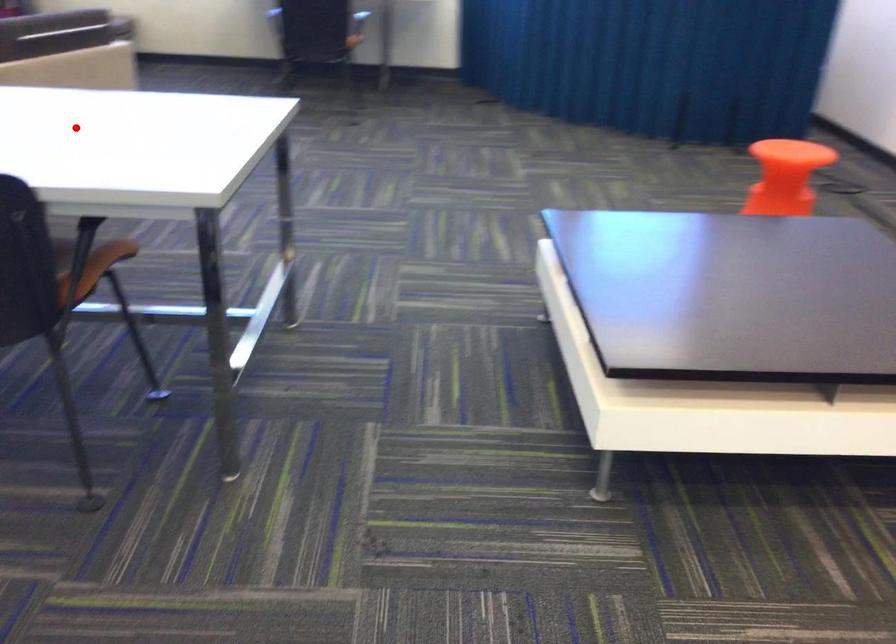
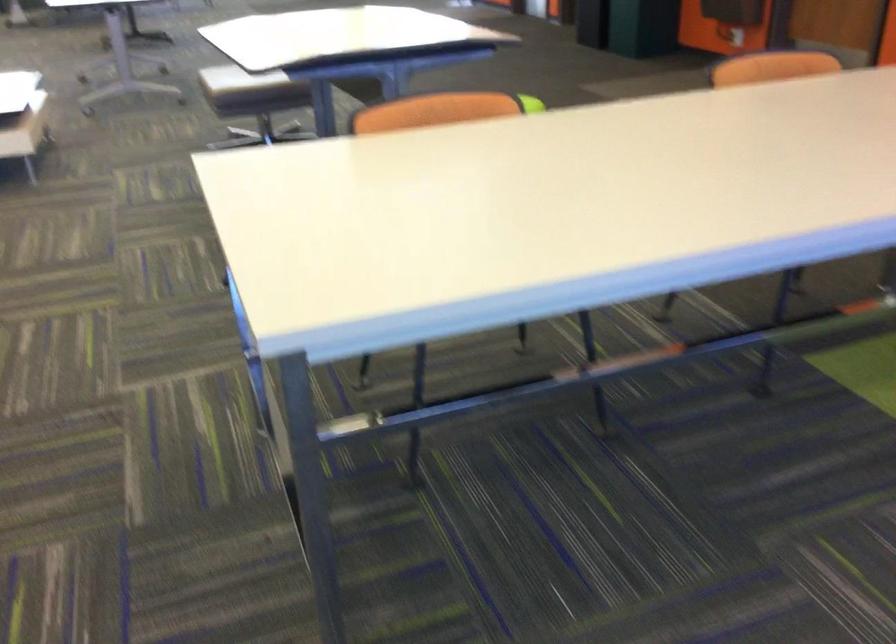
Question: I am providing you with two images of the same scene from different viewpoints. A red point is shown in image1. For the corresponding object point in image2, is it positioned nearer or farther from the camera?

Choices:
 (A) Nearer
 (B) Farther

Answer: (A)